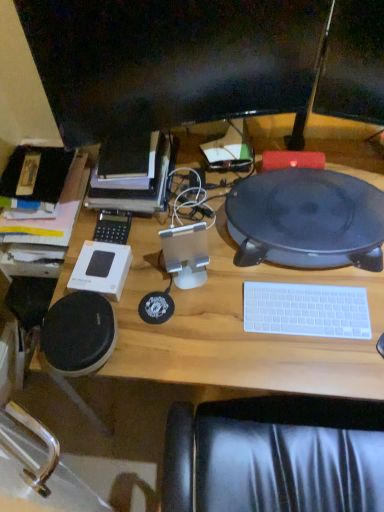
Identify the location of free space above white plastic keyboard at lower right (from a real-world perspective). (304, 307).